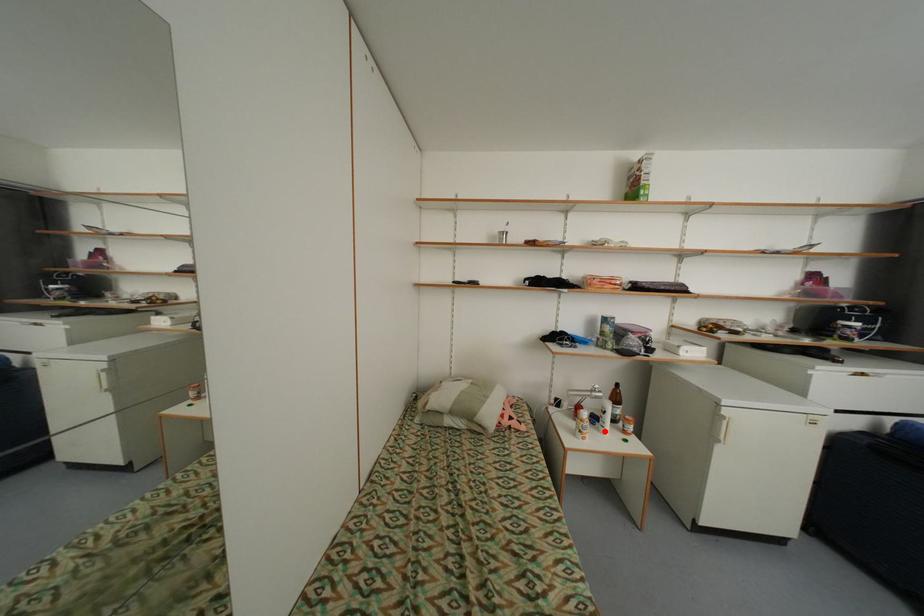
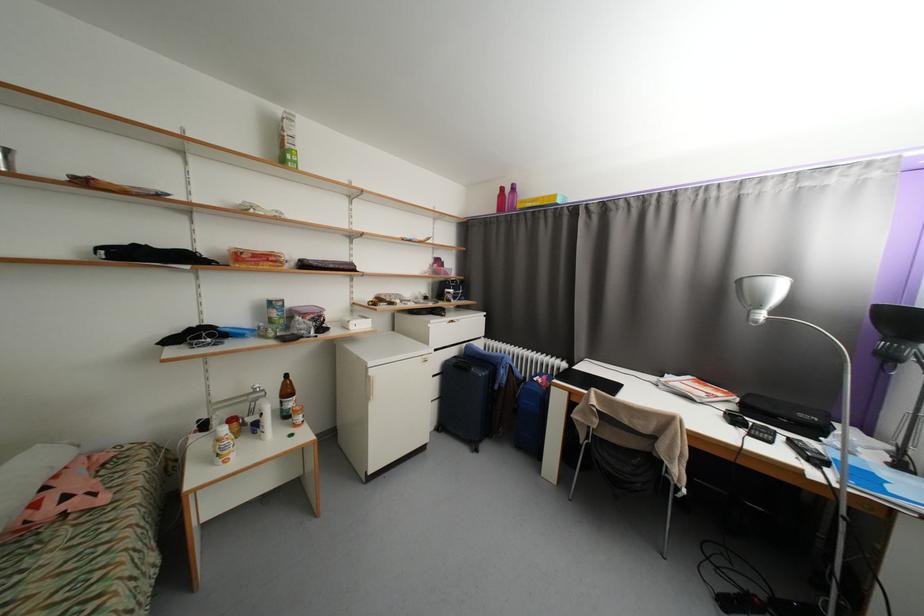
Where in the second image is the point corresponding to the highlighted location from the first image?

(265, 439)